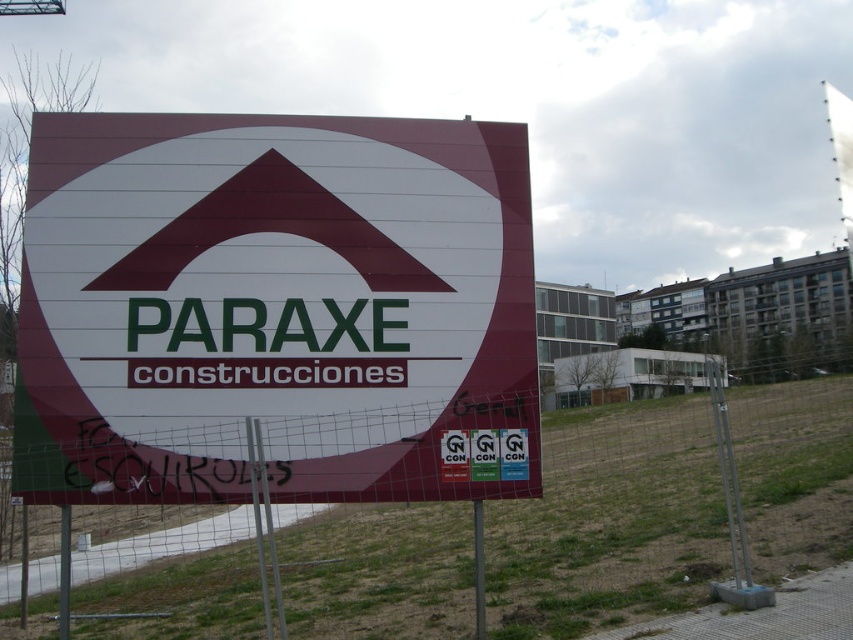
Question: Can you confirm if maroon plastic sign at center is positioned above metal mesh fence at center?

Choices:
 (A) no
 (B) yes

Answer: (B)

Question: Which of the following is the closest to the observer?

Choices:
 (A) click(224, 166)
 (B) click(596, 513)

Answer: (A)

Question: Does maroon plastic sign at center lie behind metal mesh fence at center?

Choices:
 (A) yes
 (B) no

Answer: (B)

Question: Is maroon plastic sign at center to the left of metal mesh fence at center from the viewer's perspective?

Choices:
 (A) yes
 (B) no

Answer: (A)

Question: Among these points, which one is nearest to the camera?

Choices:
 (A) (343, 540)
 (B) (96, 304)

Answer: (B)